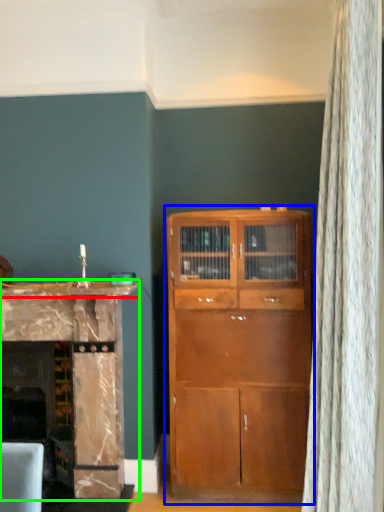
Question: Which object is the closest to the counter top (highlighted by a red box)? Choose among these: cupboard (highlighted by a blue box) or cabinetry (highlighted by a green box).

Choices:
 (A) cupboard
 (B) cabinetry

Answer: (B)